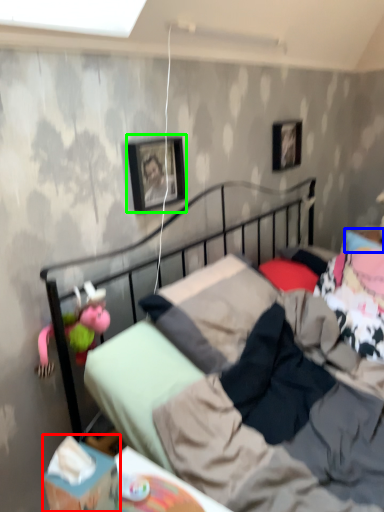
Question: Based on their relative distances, which object is farther from box (highlighted by a red box)? Choose from pillow (highlighted by a blue box) and picture frame (highlighted by a green box).

Choices:
 (A) pillow
 (B) picture frame

Answer: (A)